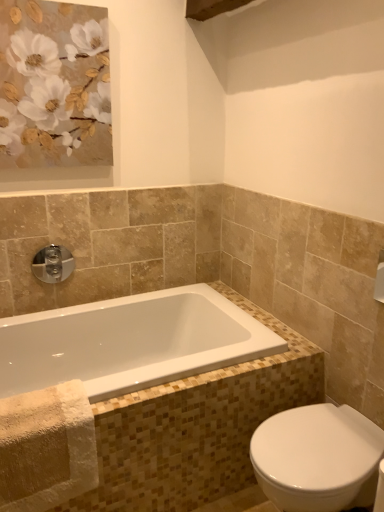
Question: From a real-world perspective, relative to chrome/metallic faucet at upper left, is white glossy bathtub at lower left vertically above or below?

Choices:
 (A) above
 (B) below

Answer: (B)

Question: Is point (130, 313) closer or farther from the camera than point (39, 256)?

Choices:
 (A) closer
 (B) farther

Answer: (B)

Question: Estimate the real-world distances between objects in this image. Which object is closer to the white glossy bathtub at lower left?

Choices:
 (A) matte gold flowers at upper left
 (B) chrome/metallic faucet at upper left
 (C) white glossy bidet at lower right

Answer: (B)

Question: Which is farther from the chrome/metallic faucet at upper left?

Choices:
 (A) white glossy bathtub at lower left
 (B) matte gold flowers at upper left
 (C) white glossy bidet at lower right

Answer: (C)